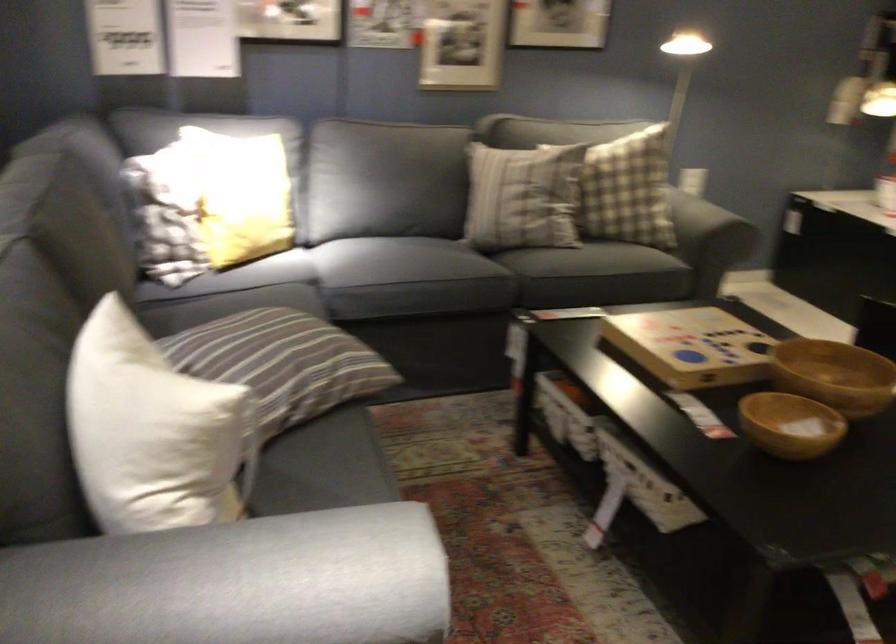
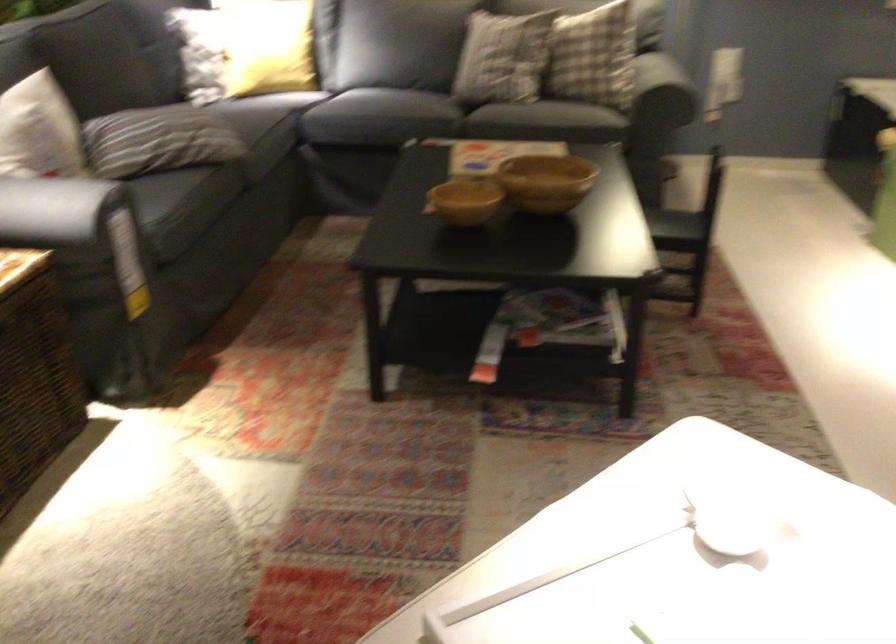
The images are taken continuously from a first-person perspective. In which direction are you moving?

The movement direction of the cameraman is right, backward.